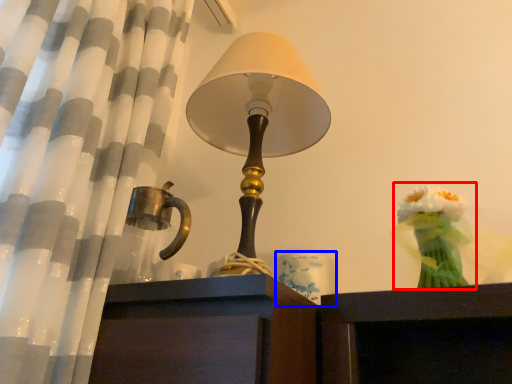
Question: Which object is closer to the camera taking this photo, floral arrangement (highlighted by a red box) or candle holder (highlighted by a blue box)?

Choices:
 (A) floral arrangement
 (B) candle holder

Answer: (A)